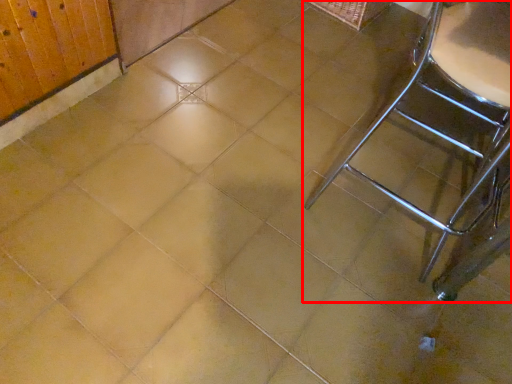
Question: Considering the relative positions of furniture (annotated by the red box) and basket in the image provided, where is furniture (annotated by the red box) located with respect to the staircase?

Choices:
 (A) left
 (B) right

Answer: (B)